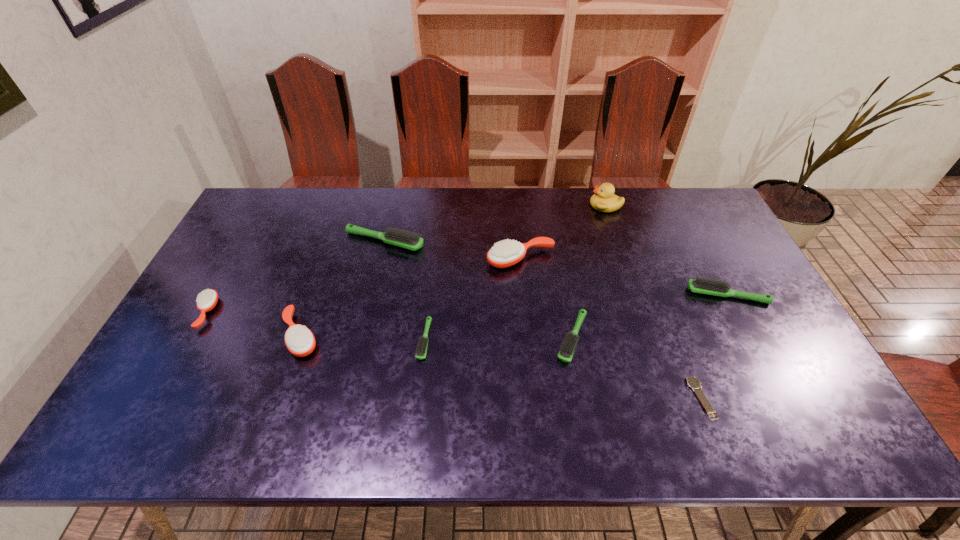
This screenshot has width=960, height=540. In order to click on the tallest object in this screenshot , I will do `click(604, 200)`.

Image resolution: width=960 pixels, height=540 pixels. In order to click on yellow duckling in this screenshot , I will do 604,200.

The width and height of the screenshot is (960, 540). I want to click on the second tallest object, so click(x=504, y=254).

What are the coordinates of `the tallest hairbrush` in the screenshot? It's located at (504, 254).

The width and height of the screenshot is (960, 540). Identify the location of the second orange hairbrush from left to right. (300, 341).

Where is `the biggest light hairbrush`? The height and width of the screenshot is (540, 960). the biggest light hairbrush is located at coordinates (408, 240).

Find the location of a particular element. the farthest light hairbrush is located at coordinates tap(408, 240).

Identify the location of the second farthest light hairbrush. The height and width of the screenshot is (540, 960). (701, 285).

The width and height of the screenshot is (960, 540). I want to click on the third smallest light hairbrush, so click(701, 285).

I want to click on the smallest orange hairbrush, so (206, 301).